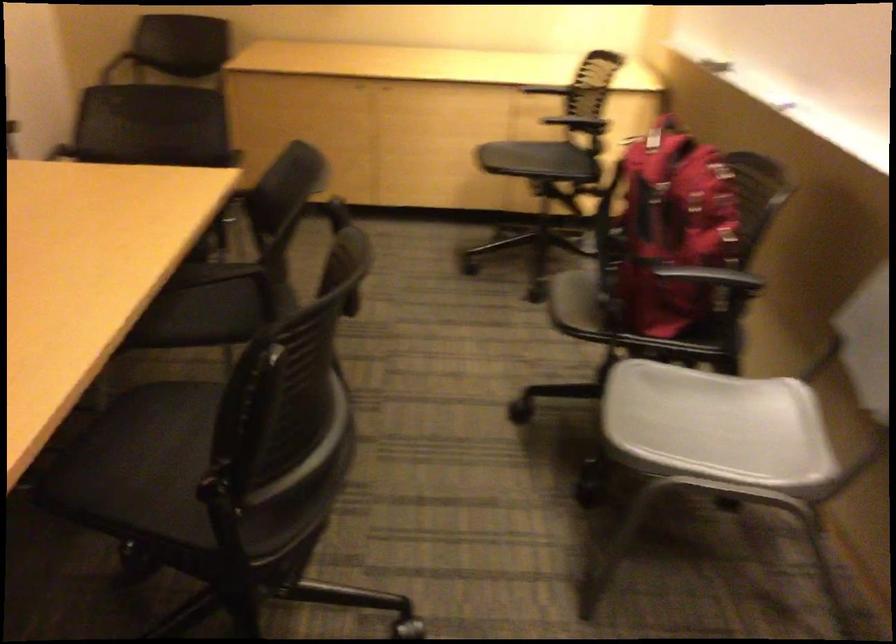
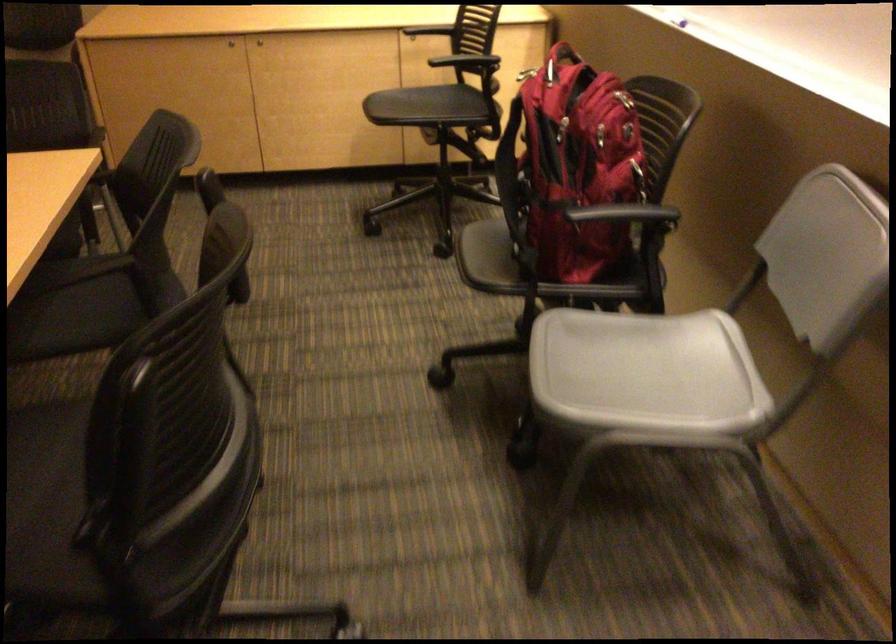
Find the pixel in the second image that matches (x=727, y=167) in the first image.

(624, 98)